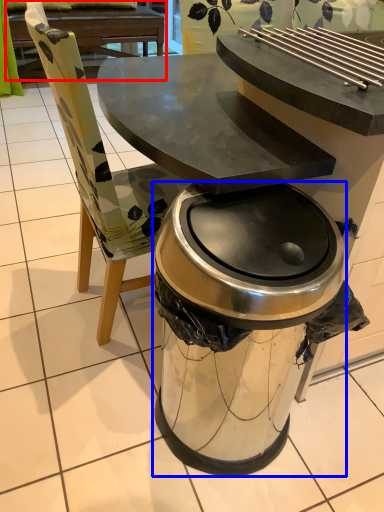
Question: Which object appears farthest to the camera in this image, picnic table (highlighted by a red box) or trash bin/can (highlighted by a blue box)?

Choices:
 (A) picnic table
 (B) trash bin/can

Answer: (A)